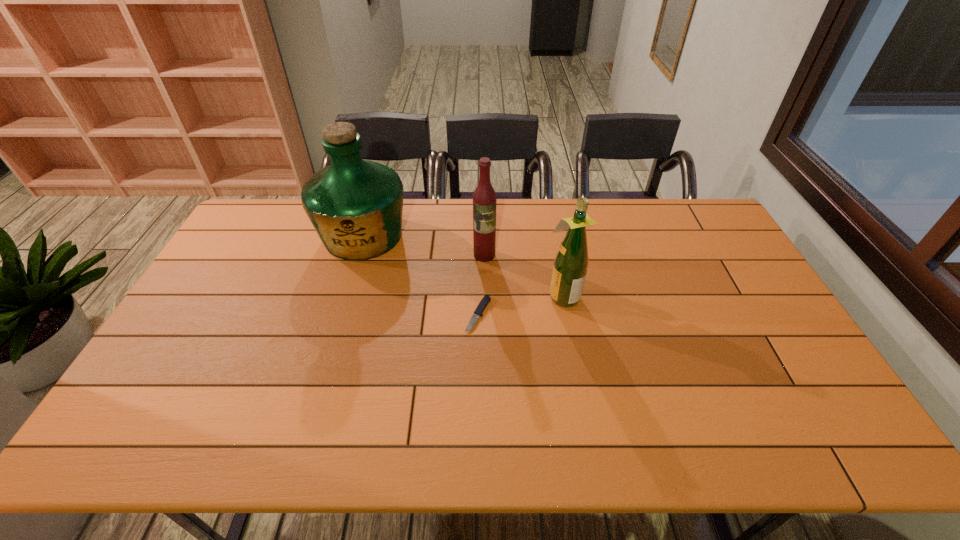
You are a GUI agent. You are given a task and a screenshot of the screen. Output one action in this format:
    pyautogui.click(x=<x>, y=<y>)
    Task: Click on the liquor identified as the closest to the second liquor from left to right
    Image resolution: width=960 pixels, height=540 pixels.
    Given the screenshot: What is the action you would take?
    pyautogui.click(x=571, y=261)

Identify which liquor is the third closest to the shortest object. Please provide its 2D coordinates. Your answer should be formatted as a tuple, i.e. [(x, y)], where the tuple contains the x and y coordinates of a point satisfying the conditions above.

[(355, 205)]